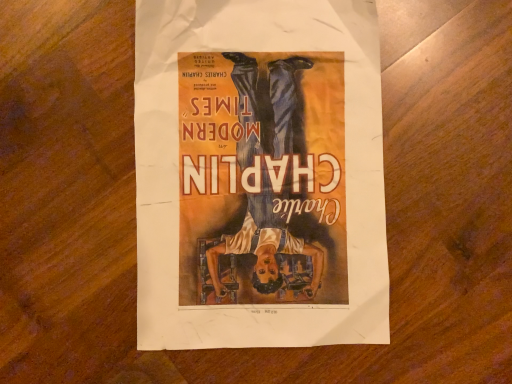
Find the location of a particular element. free space above matte paper poster at center (from a real-world perspective) is located at coordinates (264, 167).